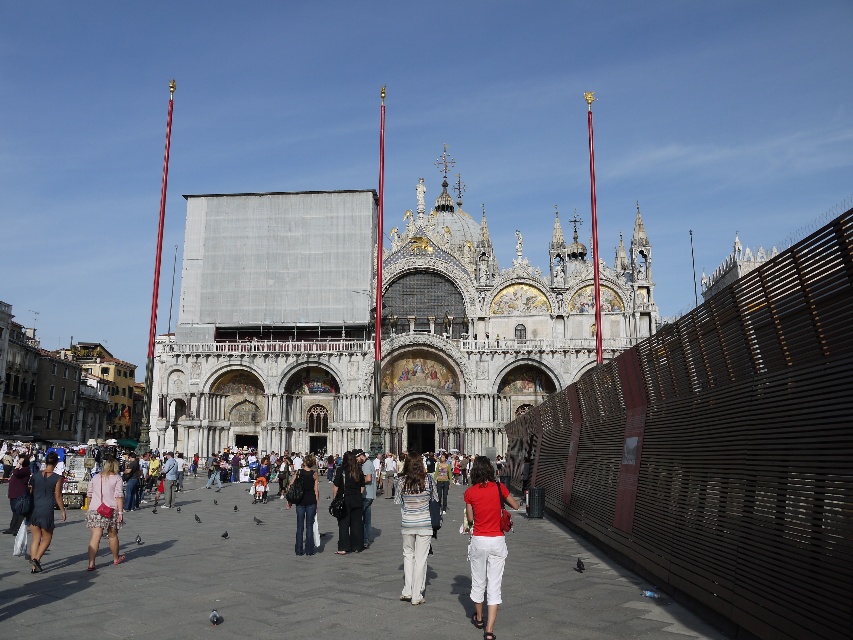
You are a tourist standing in St. Mark Square in Venice, Italy. You see a person wearing a matte red shirt at center and denim jeans at center. Which part of their clothing is taller?

The matte red shirt at center is taller than the denim jeans at center.